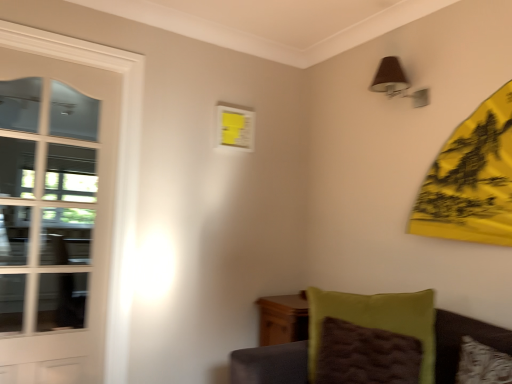
Question: From the image's perspective, is green fuzzy pillow at lower right positioned above or below velvet green cushion at lower right?

Choices:
 (A) above
 (B) below

Answer: (A)

Question: Is green fuzzy pillow at lower right in front of or behind velvet green cushion at lower right in the image?

Choices:
 (A) behind
 (B) front

Answer: (A)

Question: Estimate the real-world distances between objects in this image. Which object is farther from the white glossy door at left?

Choices:
 (A) velvet green cushion at lower right
 (B) green fuzzy pillow at lower right
 (C) brown fabric lampshade at upper right

Answer: (A)

Question: Which is farther from the brown fabric lampshade at upper right?

Choices:
 (A) white glossy door at left
 (B) velvet green cushion at lower right
 (C) green fuzzy pillow at lower right

Answer: (A)